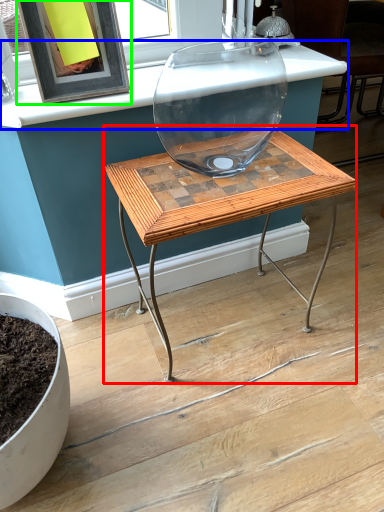
Question: Considering the real-world distances, which object is closest to table (highlighted by a red box)? counter top (highlighted by a blue box) or picture frame (highlighted by a green box).

Choices:
 (A) counter top
 (B) picture frame

Answer: (A)